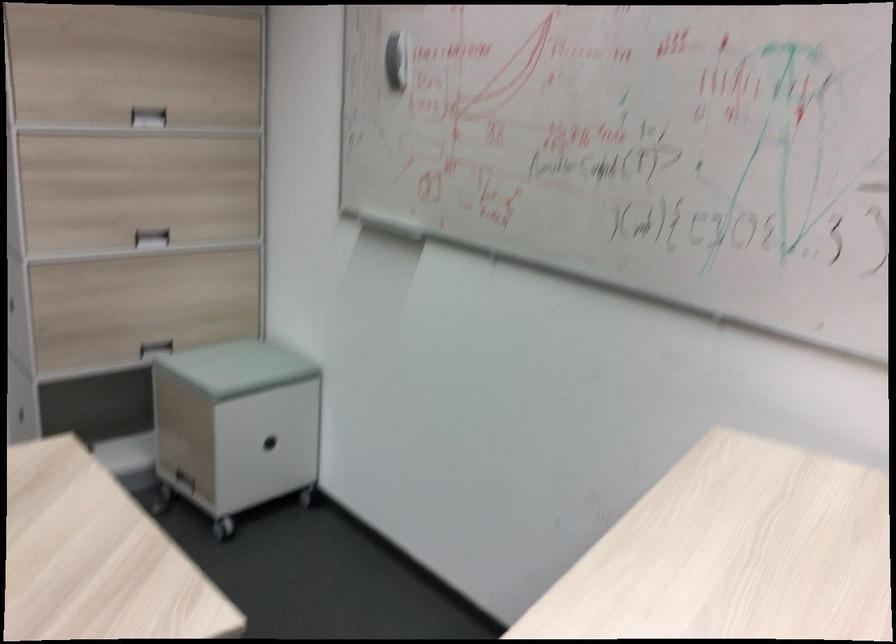
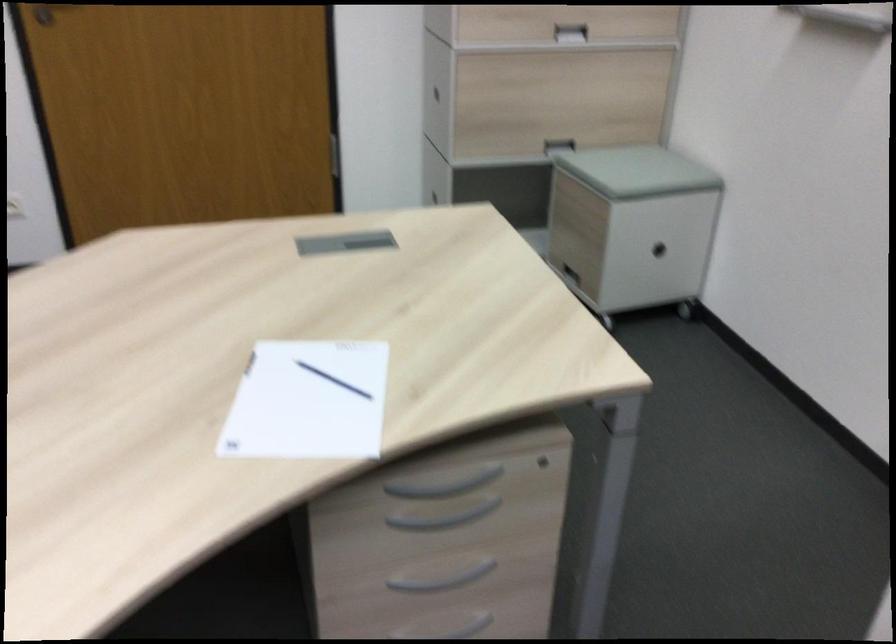
Find the pixel in the second image that matches [185,476] in the first image.

(569, 270)